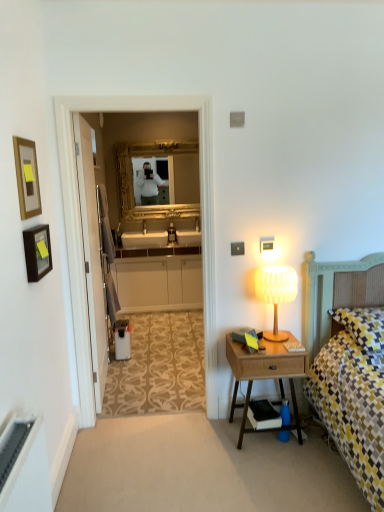
Question: Looking at the image, does gold-framed picture at left, the 1th picture frame in the top-to-bottom sequence, seem bigger or smaller compared to white ribbed glass table lamp at right?

Choices:
 (A) small
 (B) big

Answer: (A)

Question: From the image's perspective, is gold-framed picture at left, which is the 2th picture frame from bottom to top, positioned above or below white ribbed glass table lamp at right?

Choices:
 (A) below
 (B) above

Answer: (B)

Question: Estimate the real-world distances between objects in this image. Which object is farther from the white ribbed glass table lamp at right?

Choices:
 (A) gold-framed picture at left, the 1th picture frame in the top-to-bottom sequence
 (B) yellow checkered pillow at right
 (C) white matte cabinet at center
 (D) gold ornate mirror at center
 (E) woodenmaterial/texturenightstand at right

Answer: (D)

Question: Estimate the real-world distances between objects in this image. Which object is farther from the white matte cabinet at center?

Choices:
 (A) yellow checkered pillow at right
 (B) wooden picture frame at left, the 1th picture frame positioned from the bottom
 (C) gold ornate mirror at center
 (D) white ribbed glass table lamp at right
 (E) gold-framed picture at left, the 1th picture frame in the top-to-bottom sequence

Answer: (E)